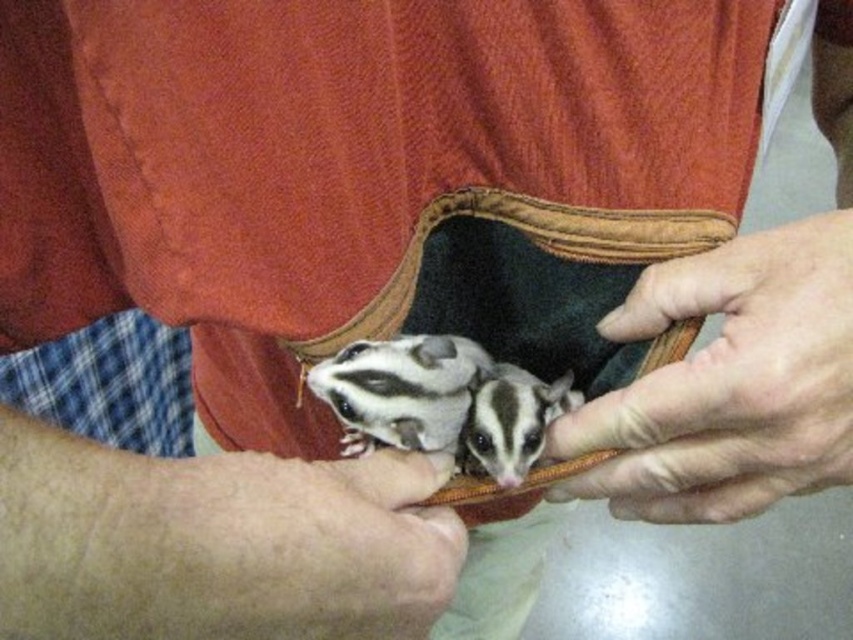
Question: Based on their relative distances, which object is farther from the black and white fur at center?

Choices:
 (A) white fur with black stripes at center
 (B) hairless skin at lower left

Answer: (B)

Question: Which point is closer to the camera?

Choices:
 (A) (535, 436)
 (B) (703, 308)

Answer: (B)

Question: Is black and white fur at center to the left of white fur with black stripes at center from the viewer's perspective?

Choices:
 (A) yes
 (B) no

Answer: (A)

Question: Which object is positioned farthest from the hairless skin at lower left?

Choices:
 (A) leather at center
 (B) white fur with black stripes at center

Answer: (A)

Question: Is the position of leather at center less distant than that of white fur with black stripes at center?

Choices:
 (A) no
 (B) yes

Answer: (B)

Question: Is hairless skin at lower left bigger than black and white fur at center?

Choices:
 (A) yes
 (B) no

Answer: (A)